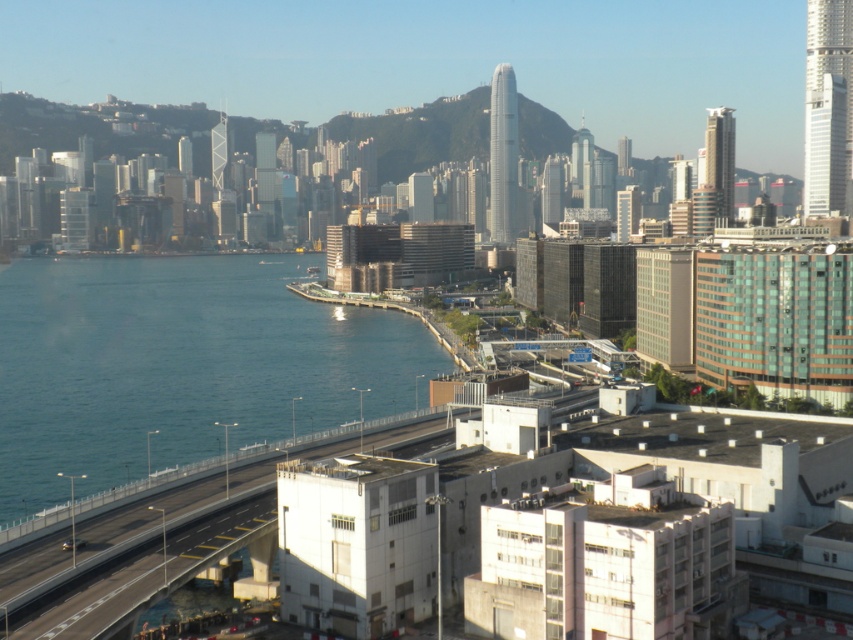
You are a drone operator planning to fly a drone from the blue water at lower left to the concrete bridge at lower center. Considering the spatial relationship between them, which direction should you fly the drone to reach the bridge?

The blue water at lower left is much taller than the concrete bridge at lower center, so you should fly the drone downward towards the concrete bridge at lower center.

You are a drone operator who needs to deliver a package from point A to point B in the city. The coordinates of point A are point A at (27, 310). The distance between them is 383.49 meters. Can your drone, which has a maximum flight range of 400 meters, complete the delivery?

The distance between point A at (27, 310) and point B is 383.49 meters. Since the drone has a maximum flight range of 400 meters, it can complete the delivery as the required distance is within its range.